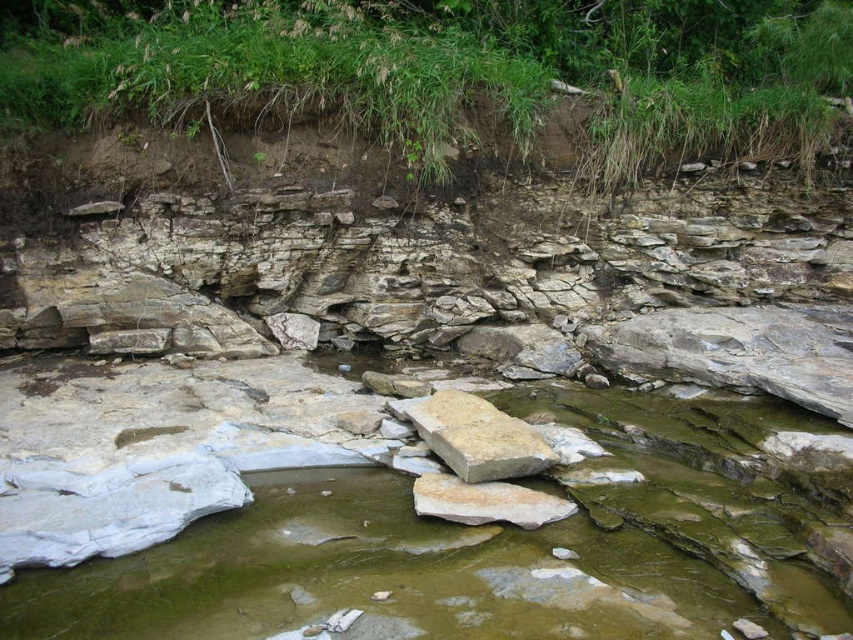
You are standing on the riverbank and want to cross to the other side. You see a light brown rock at center and a smooth beige rock at center in the river. Which rock should you step on first if you want to step on the taller one first?

You should step on the light brown rock at center first because it is taller than the smooth beige rock at center.

You are standing at the origin point of the riverbed. You want to place a small flag exactly at the location of the light brown rock at center. What are the coordinates where you should place the flag?

The coordinates for the light brown rock at center are at point (479, 436), so you should place the flag at those coordinates.

You are standing at the edge of the river and see a point marked at coordinates (479, 436). What object is located at that point?

The point at coordinates (479, 436) indicates a light brown rock at center.